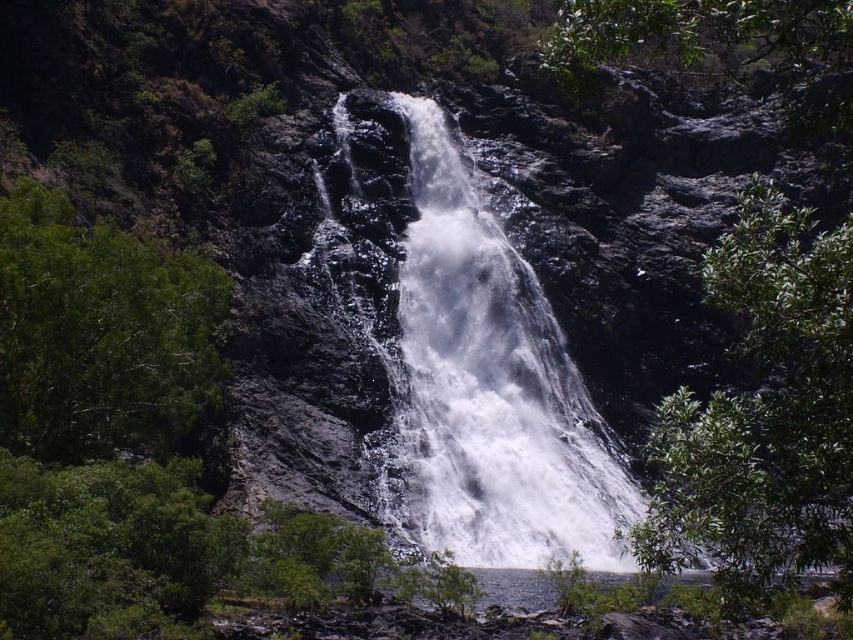
Question: From the image, what is the correct spatial relationship of white frothy water at center in relation to green leafy tree at left?

Choices:
 (A) right
 (B) left

Answer: (A)

Question: Based on their relative distances, which object is nearer to the green leafy tree at right?

Choices:
 (A) green leafy tree at left
 (B) white frothy water at center

Answer: (B)

Question: Which point appears farthest from the camera in this image?

Choices:
 (A) (67, 403)
 (B) (503, 464)
 (C) (782, 465)

Answer: (B)

Question: Estimate the real-world distances between objects in this image. Which object is farther from the green leafy tree at left?

Choices:
 (A) white frothy water at center
 (B) green leafy tree at right

Answer: (B)

Question: Is white frothy water at center to the right of green leafy tree at right from the viewer's perspective?

Choices:
 (A) yes
 (B) no

Answer: (B)

Question: Is green leafy tree at right above green leafy tree at left?

Choices:
 (A) yes
 (B) no

Answer: (B)